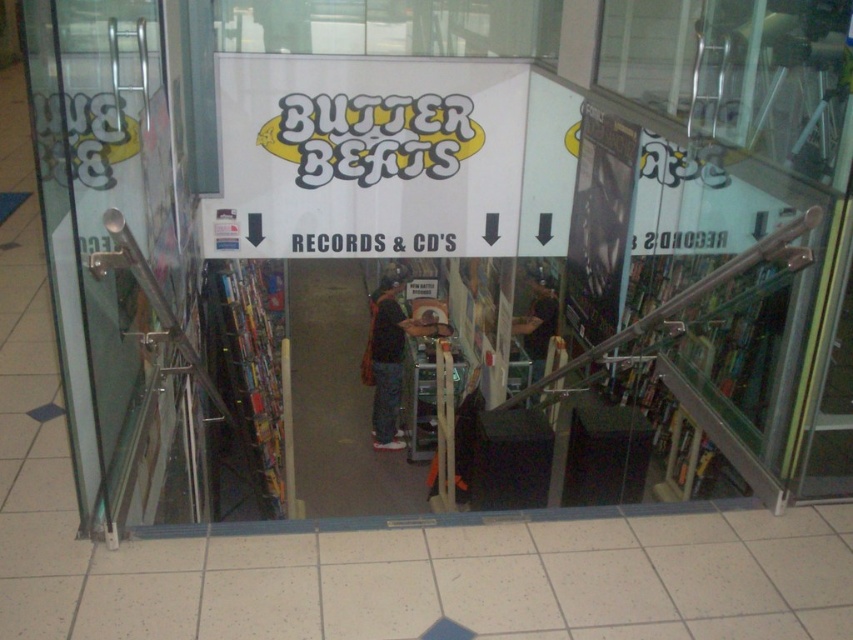
Question: Where is transparent glass door at left located in relation to dark gray carpet at center in the image?

Choices:
 (A) right
 (B) left

Answer: (B)

Question: Can you confirm if transparent glass door at left is thinner than dark gray carpet at center?

Choices:
 (A) yes
 (B) no

Answer: (A)

Question: Does transparent glass door at left have a smaller size compared to dark gray carpet at center?

Choices:
 (A) yes
 (B) no

Answer: (A)

Question: Which of the following is the closest to the observer?

Choices:
 (A) (113, 141)
 (B) (366, 285)

Answer: (A)

Question: Among these objects, which one is farthest from the camera?

Choices:
 (A) transparent glass door at left
 (B) dark gray carpet at center

Answer: (B)

Question: Among these objects, which one is farthest from the camera?

Choices:
 (A) dark gray carpet at center
 (B) transparent glass door at left

Answer: (A)